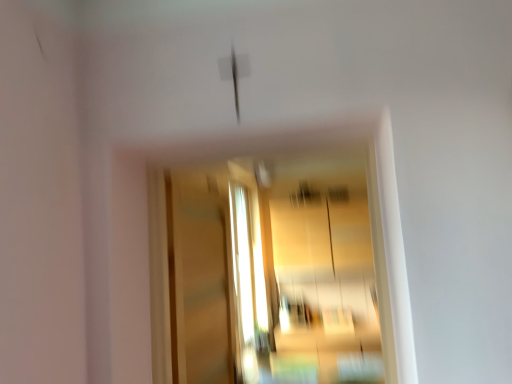
The image size is (512, 384). What do you see at coordinates (200, 282) in the screenshot?
I see `translucent glass door at center` at bounding box center [200, 282].

Where is `translucent glass door at center`? Image resolution: width=512 pixels, height=384 pixels. translucent glass door at center is located at coordinates (200, 282).

Measure the distance between point (187, 242) and camera.

A distance of 5.59 feet exists between point (187, 242) and camera.

The height and width of the screenshot is (384, 512). Identify the location of translucent glass door at center. (200, 282).